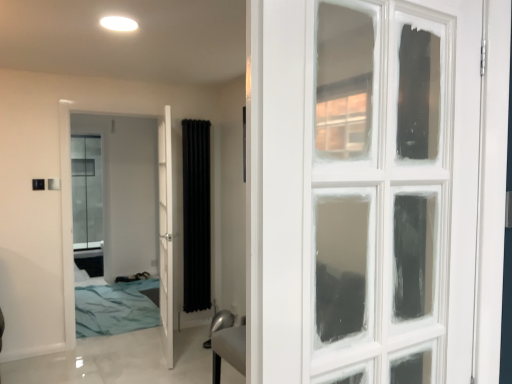
Where is `white glossy door at center, the first door when ordered from left to right`? white glossy door at center, the first door when ordered from left to right is located at coordinates (66, 219).

How much space does white glossy door at center, which appears as the 2th door when viewed from the left, occupy horizontally?

white glossy door at center, which appears as the 2th door when viewed from the left, is 3.82 inches in width.

Locate an element on the screen. This screenshot has height=384, width=512. black fabric radiator at center is located at coordinates (196, 215).

Find the location of a particular element. The width and height of the screenshot is (512, 384). white glossy door at center, acting as the second door starting from the right is located at coordinates (66, 219).

Choose the correct answer: Is white glossy door at center, which ranks as the 1th door in right-to-left order, inside white glossy door at center, acting as the second door starting from the right, or outside it?

white glossy door at center, which ranks as the 1th door in right-to-left order, is outside white glossy door at center, acting as the second door starting from the right.

The width and height of the screenshot is (512, 384). Identify the location of door behind the white glossy door at center, which ranks as the 1th door in right-to-left order. (66, 219).

Is white glossy door at center, which appears as the 2th door when viewed from the left, turned away from white glossy door at center, the first door when ordered from left to right?

No, white glossy door at center, which appears as the 2th door when viewed from the left, is not facing the opposite direction of white glossy door at center, the first door when ordered from left to right.

Is the surface of white glossy door at center, which ranks as the 1th door in right-to-left order, in direct contact with white glossy door at center, acting as the second door starting from the right?

Yes, white glossy door at center, which ranks as the 1th door in right-to-left order, is touching white glossy door at center, acting as the second door starting from the right.

From a real-world perspective, does black fabric radiator at center stand above white glossy door at center, the first door when ordered from left to right?

Yes, from a real-world perspective, black fabric radiator at center is above white glossy door at center, the first door when ordered from left to right.

Considering the relative positions of black fabric radiator at center and white glossy door at center, acting as the second door starting from the right, in the image provided, is black fabric radiator at center in front of white glossy door at center, acting as the second door starting from the right,?

No, the depth of black fabric radiator at center is greater than that of white glossy door at center, acting as the second door starting from the right.

Consider the image. Choose the correct answer: Is black fabric radiator at center inside white glossy door at center, the first door when ordered from left to right, or outside it?

black fabric radiator at center exists outside the volume of white glossy door at center, the first door when ordered from left to right.

Are black fabric radiator at center and white glossy door at center, the first door when ordered from left to right, beside each other?

Result: black fabric radiator at center is not next to white glossy door at center, the first door when ordered from left to right, and they're not touching.

Does white glossy door at center, acting as the second door starting from the right, turn towards white glossy door at center, which appears as the 2th door when viewed from the left?

Yes, white glossy door at center, acting as the second door starting from the right, is oriented towards white glossy door at center, which appears as the 2th door when viewed from the left.

Consider the image. Is the position of white glossy door at center, the first door when ordered from left to right, less distant than that of white glossy door at center, which appears as the 2th door when viewed from the left?

No.

From a real-world perspective, is white glossy door at center, acting as the second door starting from the right, above or below white glossy door at center, which ranks as the 1th door in right-to-left order?

A: In terms of real-world spatial position, white glossy door at center, acting as the second door starting from the right, is above white glossy door at center, which ranks as the 1th door in right-to-left order.

From a real-world perspective, relative to black fabric radiator at center, is white glossy door at center, which appears as the 2th door when viewed from the left, vertically above or below?

white glossy door at center, which appears as the 2th door when viewed from the left, is below black fabric radiator at center.

What's the angular difference between white glossy door at center, which appears as the 2th door when viewed from the left, and black fabric radiator at center's facing directions?

There is a 101-degree angle between the facing directions of white glossy door at center, which appears as the 2th door when viewed from the left, and black fabric radiator at center.

Which is more to the left, white glossy door at center, which appears as the 2th door when viewed from the left, or black fabric radiator at center?

Positioned to the left is white glossy door at center, which appears as the 2th door when viewed from the left.

Image resolution: width=512 pixels, height=384 pixels. In order to click on curtain on the right of white glossy door at center, which ranks as the 1th door in right-to-left order in this screenshot , I will do `click(196, 215)`.

Who is bigger, black fabric radiator at center or white glossy door at center, which ranks as the 1th door in right-to-left order?

With larger size is white glossy door at center, which ranks as the 1th door in right-to-left order.

Identify the location of curtain behind the white glossy door at center, which appears as the 2th door when viewed from the left. Image resolution: width=512 pixels, height=384 pixels. (196, 215).

Between black fabric radiator at center and white glossy door at center, which appears as the 2th door when viewed from the left, which one has larger width?

Wider between the two is white glossy door at center, which appears as the 2th door when viewed from the left.

Would you say white glossy door at center, the first door when ordered from left to right, is outside black fabric radiator at center?

white glossy door at center, the first door when ordered from left to right, is positioned outside black fabric radiator at center.

Does point (164, 118) come behind point (185, 170)?

No, (164, 118) is in front of (185, 170).

Can you confirm if white glossy door at center, the first door when ordered from left to right, is positioned to the right of black fabric radiator at center?

In fact, white glossy door at center, the first door when ordered from left to right, is to the left of black fabric radiator at center.

Between white glossy door at center, the first door when ordered from left to right, and black fabric radiator at center, which one has smaller size?

black fabric radiator at center.

Where is `door above the white glossy door at center, which ranks as the 1th door in right-to-left order (from the image's perspective)`? door above the white glossy door at center, which ranks as the 1th door in right-to-left order (from the image's perspective) is located at coordinates (66, 219).

Locate an element on the screen. the 1st door in front when counting from the black fabric radiator at center is located at coordinates (66, 219).

Estimate the real-world distances between objects in this image. Which object is further from white glossy door at center, which appears as the 2th door when viewed from the left, black fabric radiator at center or white glossy door at center, the first door when ordered from left to right?

black fabric radiator at center is further to white glossy door at center, which appears as the 2th door when viewed from the left.

Based on their spatial positions, is white glossy door at center, which appears as the 2th door when viewed from the left, or black fabric radiator at center closer to white glossy door at center, the first door when ordered from left to right?

Among the two, white glossy door at center, which appears as the 2th door when viewed from the left, is located nearer to white glossy door at center, the first door when ordered from left to right.

Based on their spatial positions, is white glossy door at center, the first door when ordered from left to right, or white glossy door at center, which ranks as the 1th door in right-to-left order, closer to black fabric radiator at center?

white glossy door at center, which ranks as the 1th door in right-to-left order, lies closer to black fabric radiator at center than the other object.

From the image, which object appears to be nearer to black fabric radiator at center, white glossy door at center, which appears as the 2th door when viewed from the left, or white glossy door at center, the first door when ordered from left to right?

white glossy door at center, which appears as the 2th door when viewed from the left, is closer to black fabric radiator at center.

When comparing their distances from white glossy door at center, which ranks as the 1th door in right-to-left order, does white glossy door at center, acting as the second door starting from the right, or black fabric radiator at center seem further?

The object further to white glossy door at center, which ranks as the 1th door in right-to-left order, is black fabric radiator at center.

Estimate the real-world distances between objects in this image. Which object is further from white glossy door at center, acting as the second door starting from the right, black fabric radiator at center or white glossy door at center, which appears as the 2th door when viewed from the left?

Among the two, black fabric radiator at center is located further to white glossy door at center, acting as the second door starting from the right.

At what (x,y) coordinates should I click in order to perform the action: click on door between white glossy door at center, which ranks as the 1th door in right-to-left order, and black fabric radiator at center in the front-back direction. Please return your answer as a coordinate pair (x, y). Image resolution: width=512 pixels, height=384 pixels. Looking at the image, I should click on (66, 219).